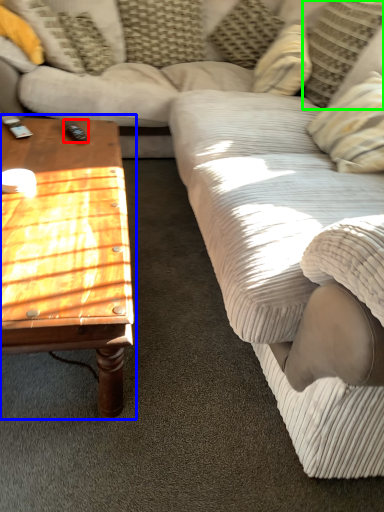
Question: Estimate the real-world distances between objects in this image. Which object is closer to remote (highlighted by a red box), coffee table (highlighted by a blue box) or pillow (highlighted by a green box)?

Choices:
 (A) coffee table
 (B) pillow

Answer: (A)